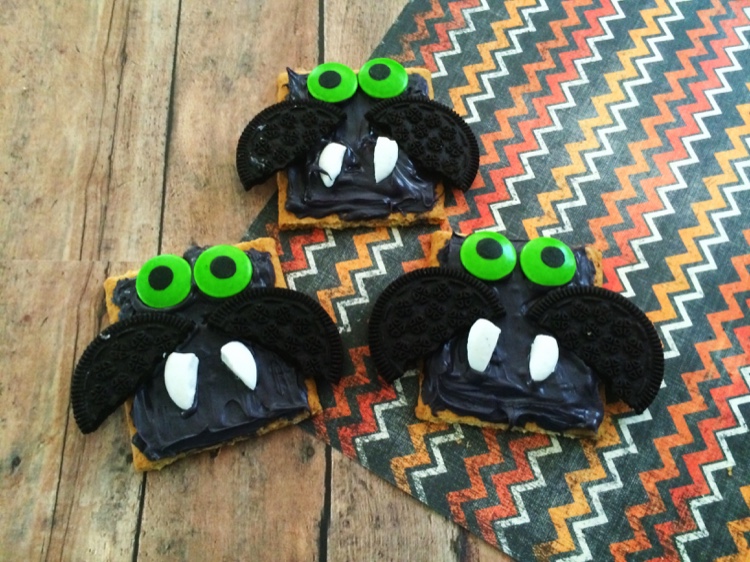
The height and width of the screenshot is (562, 750). I want to click on rug, so [x=565, y=158].